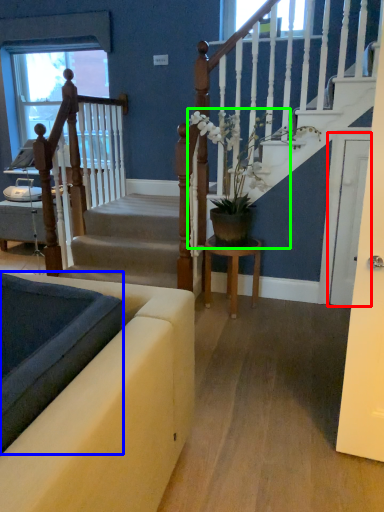
Question: Considering the real-world distances, which object is closest to glass door (highlighted by a red box)? landing (highlighted by a blue box) or houseplant (highlighted by a green box).

Choices:
 (A) landing
 (B) houseplant

Answer: (B)